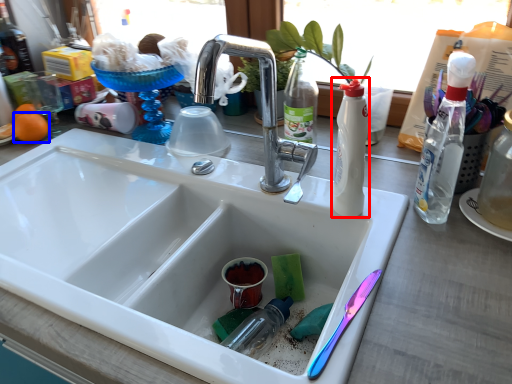
Question: Which object is further to the camera taking this photo, bottle (highlighted by a red box) or orange (highlighted by a blue box)?

Choices:
 (A) bottle
 (B) orange

Answer: (B)